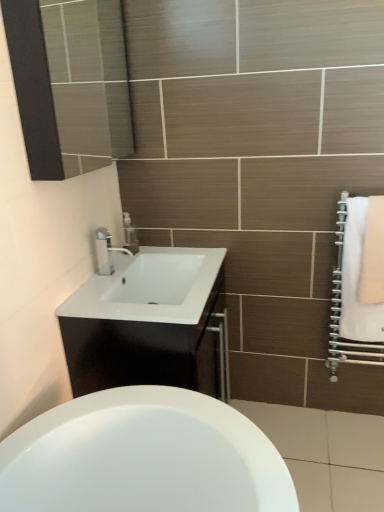
Question: Can you confirm if white soft towel at right, arranged as the second bath towel when viewed from the right, is smaller than white soft towel at right, the second bath towel viewed from the left?

Choices:
 (A) no
 (B) yes

Answer: (A)

Question: From a real-world perspective, is white soft towel at right, arranged as the first bath towel when viewed from the left, on top of white soft towel at right, the second bath towel viewed from the left?

Choices:
 (A) no
 (B) yes

Answer: (A)

Question: From the image's perspective, would you say white soft towel at right, arranged as the second bath towel when viewed from the right, is positioned over white soft towel at right, the second bath towel viewed from the left?

Choices:
 (A) no
 (B) yes

Answer: (A)

Question: Is white soft towel at right, arranged as the second bath towel when viewed from the right, bigger than white soft towel at right, the second bath towel viewed from the left?

Choices:
 (A) no
 (B) yes

Answer: (B)

Question: Is white soft towel at right, which appears as the 1th bath towel when viewed from the right, surrounded by white soft towel at right, arranged as the second bath towel when viewed from the right?

Choices:
 (A) no
 (B) yes

Answer: (B)

Question: Relative to clear plastic soap dispenser at upper center, is white soft towel at right, the second bath towel viewed from the left, in front or behind?

Choices:
 (A) behind
 (B) front

Answer: (B)

Question: Looking at the image, does white soft towel at right, which appears as the 1th bath towel when viewed from the right, seem bigger or smaller compared to clear plastic soap dispenser at upper center?

Choices:
 (A) small
 (B) big

Answer: (B)

Question: Does point (365, 280) appear closer or farther from the camera than point (129, 227)?

Choices:
 (A) farther
 (B) closer

Answer: (B)

Question: Considering the positions of white soft towel at right, the second bath towel viewed from the left, and clear plastic soap dispenser at upper center in the image, is white soft towel at right, the second bath towel viewed from the left, wider or thinner than clear plastic soap dispenser at upper center?

Choices:
 (A) wide
 (B) thin

Answer: (A)

Question: Is point (135, 229) positioned closer to the camera than point (360, 234)?

Choices:
 (A) farther
 (B) closer

Answer: (A)

Question: Looking at their shapes, would you say clear plastic soap dispenser at upper center is wider or thinner than white soft towel at right, arranged as the first bath towel when viewed from the left?

Choices:
 (A) thin
 (B) wide

Answer: (B)

Question: Based on their positions, is clear plastic soap dispenser at upper center located to the left or right of white soft towel at right, arranged as the second bath towel when viewed from the right?

Choices:
 (A) right
 (B) left

Answer: (B)

Question: Which is correct: clear plastic soap dispenser at upper center is inside white soft towel at right, arranged as the second bath towel when viewed from the right, or outside of it?

Choices:
 (A) inside
 (B) outside

Answer: (B)

Question: Is white glossy cabinet at center inside or outside of clear plastic soap dispenser at upper center?

Choices:
 (A) inside
 (B) outside

Answer: (B)

Question: Is white glossy cabinet at center in front of or behind clear plastic soap dispenser at upper center in the image?

Choices:
 (A) front
 (B) behind

Answer: (A)